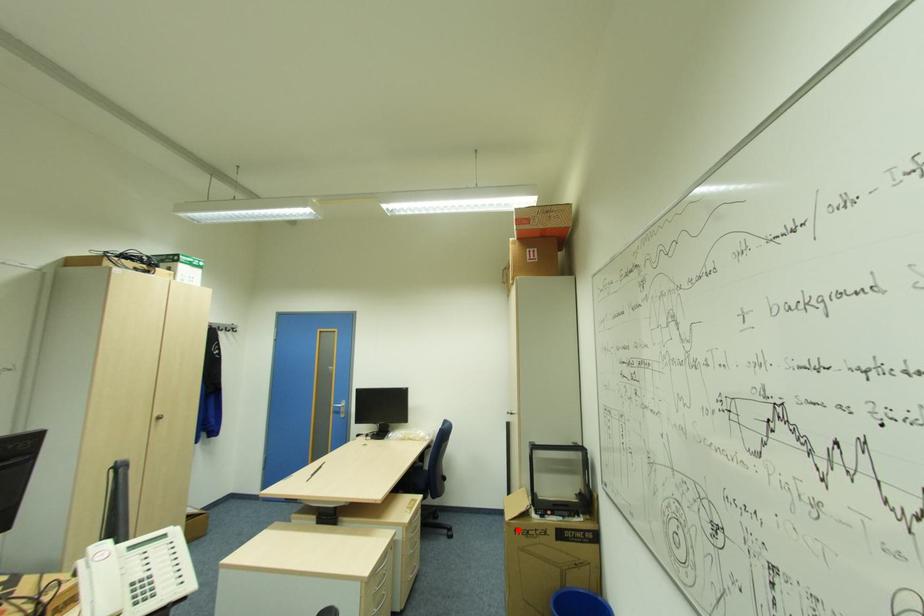
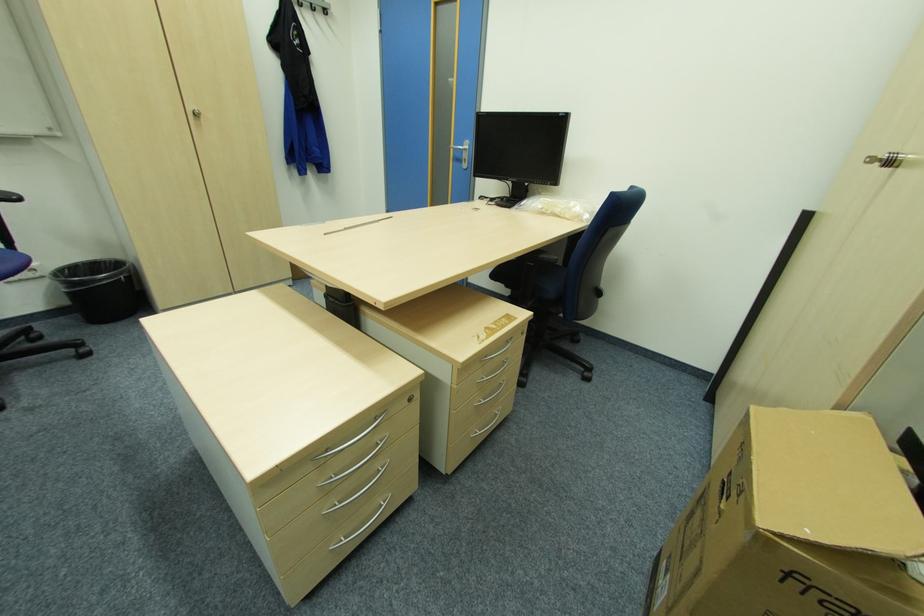
Where in the second image is the point corresponding to the highlighted location from the first image?

(789, 573)